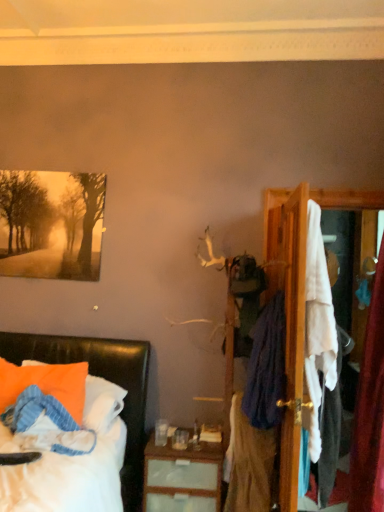
This screenshot has height=512, width=384. What are the coordinates of `free spot above matte paper painting at upper left (from a real-world perspective)` in the screenshot? It's located at (56, 167).